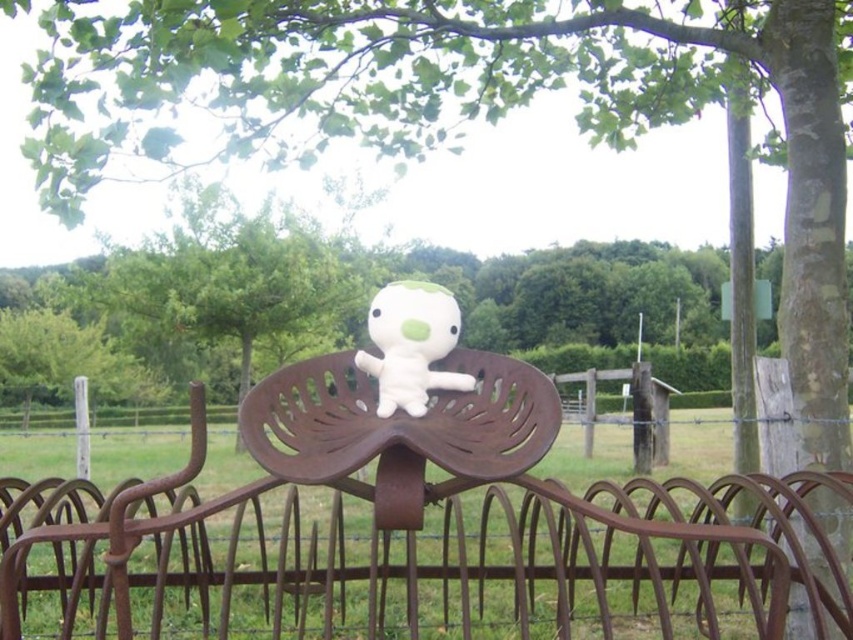
Question: Which of the following is the closest to the observer?

Choices:
 (A) (7, 516)
 (B) (404, 304)

Answer: (A)

Question: Which of the following is the closest to the observer?

Choices:
 (A) (392, 368)
 (B) (405, 611)

Answer: (A)

Question: Is rusty metal rake at center to the left of white plush toy at center from the viewer's perspective?

Choices:
 (A) yes
 (B) no

Answer: (A)

Question: Is the position of rusty metal rake at center more distant than that of white plush toy at center?

Choices:
 (A) yes
 (B) no

Answer: (B)

Question: Can you confirm if rusty metal rake at center is positioned to the right of white plush toy at center?

Choices:
 (A) no
 (B) yes

Answer: (A)